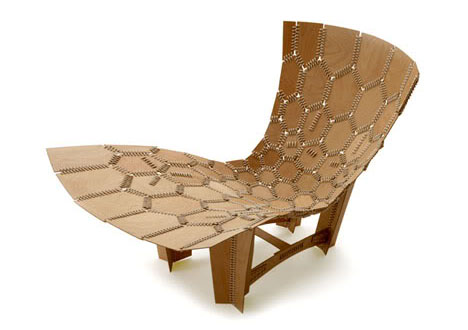
Find the location of a particular element. chair chadow is located at coordinates (293, 276).